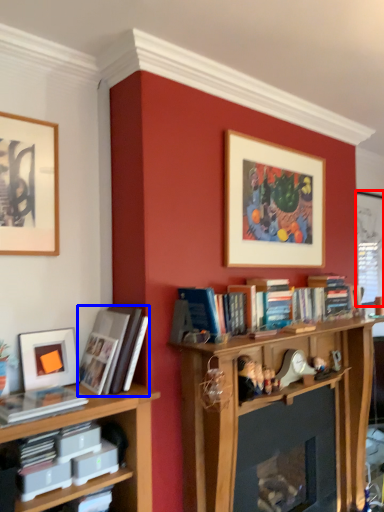
Question: Which object is further to the camera taking this photo, window screen (highlighted by a red box) or book (highlighted by a blue box)?

Choices:
 (A) window screen
 (B) book

Answer: (A)